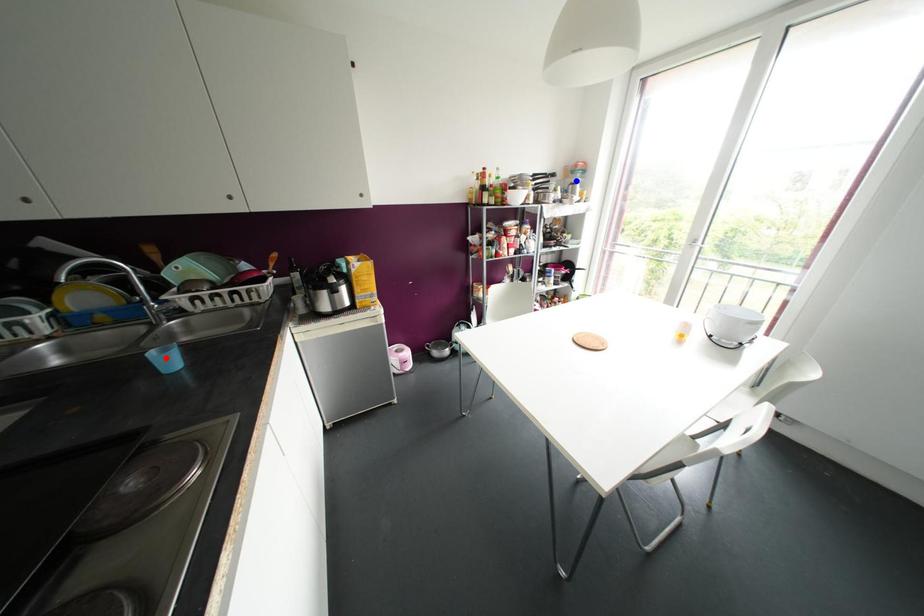
Question: In the image, two points are highlighted. Which point is nearer to the camera? Reply with the corresponding letter.

Choices:
 (A) blue point
 (B) red point

Answer: (B)